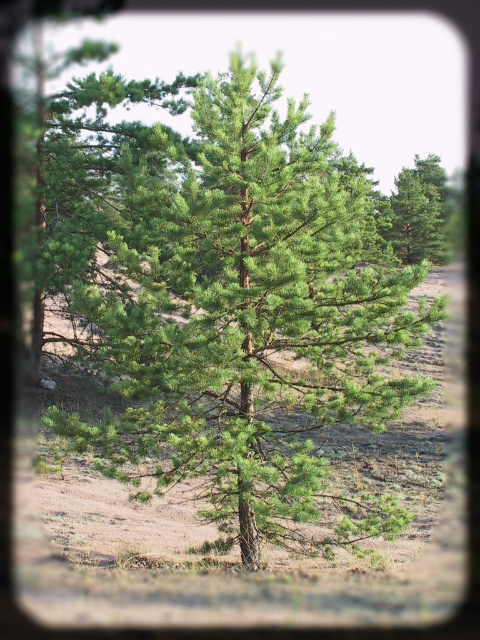
You are standing at the base of the solitary pine tree in the image. You want to walk to the point marked at coordinates point (179,266). How far will you have to walk?

The distance between point (179,266) and the viewer is 7.67 meters, so you will have to walk 7.67 meters to reach that point.